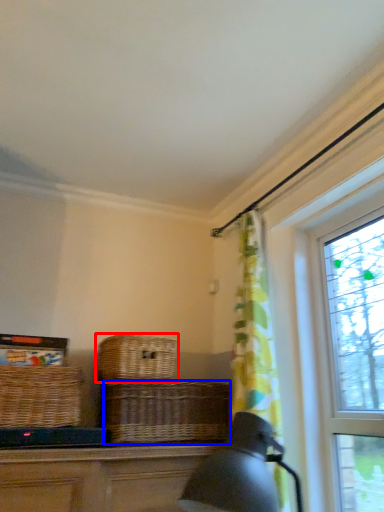
Question: Which object is further to the camera taking this photo, picnic basket (highlighted by a red box) or basket (highlighted by a blue box)?

Choices:
 (A) picnic basket
 (B) basket

Answer: (A)